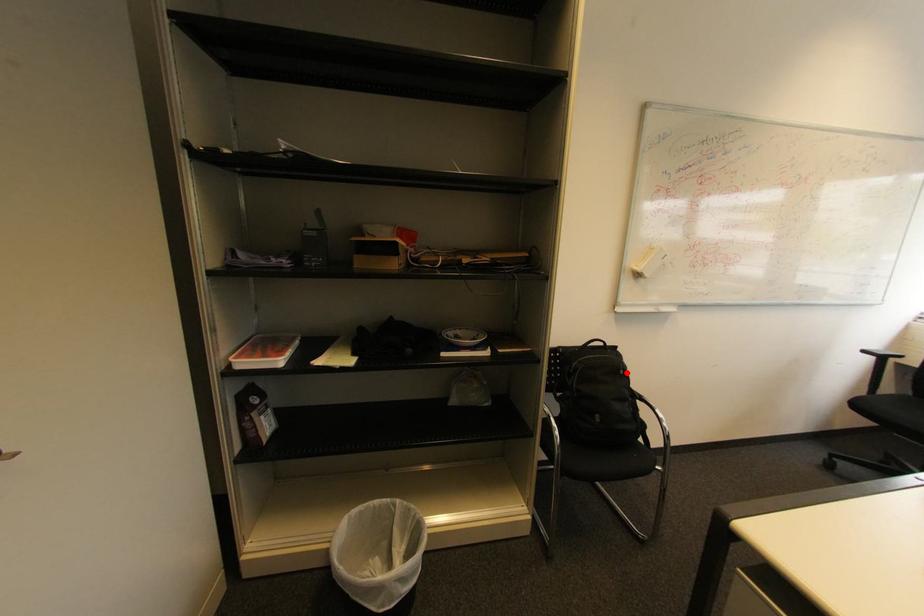
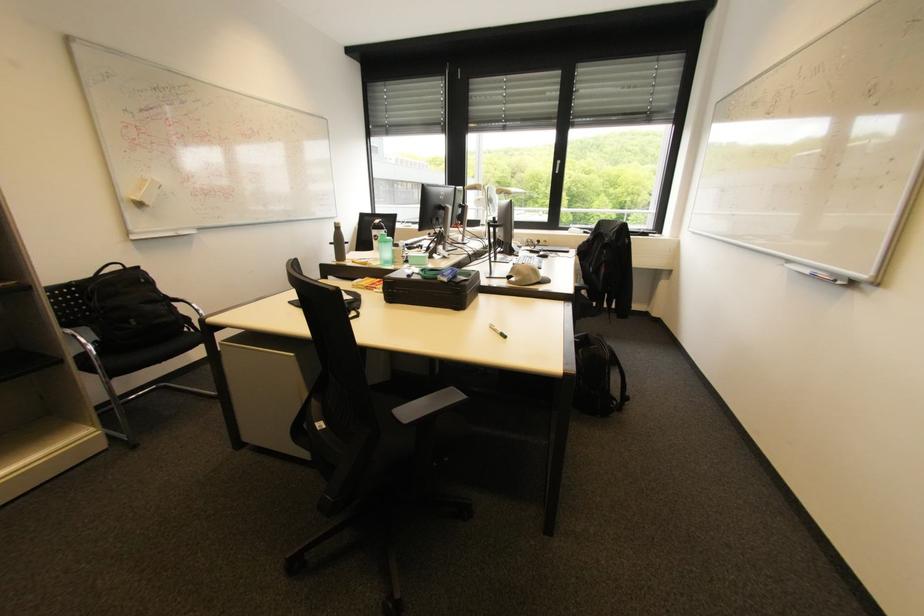
In the second image, find the point that corresponds to the highlighted location in the first image.

(148, 281)